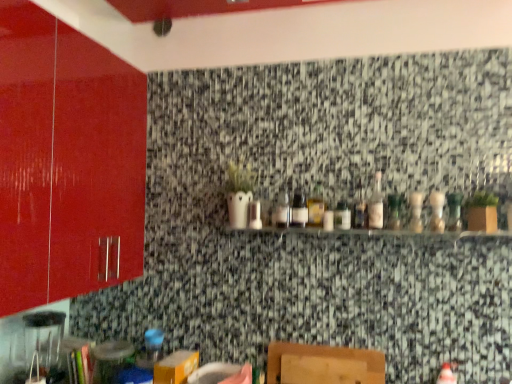
Question: Which direction should I rotate to look at green glass bottle at center, arranged as the 4th bottle when viewed from the right?

Choices:
 (A) left
 (B) right

Answer: (B)

Question: Is translucent glass bottle at center, which is counted as the 3th bottle, starting from the right, facing towards clear glass shelf at center?

Choices:
 (A) yes
 (B) no

Answer: (B)

Question: Considering the relative positions of translucent glass bottle at center, which is counted as the 3th bottle, starting from the right, and clear glass shelf at center in the image provided, is translucent glass bottle at center, which is counted as the 3th bottle, starting from the right, to the left of clear glass shelf at center from the viewer's perspective?

Choices:
 (A) yes
 (B) no

Answer: (B)

Question: Is translucent glass bottle at center, acting as the 7th bottle starting from the left, placed right next to clear glass shelf at center?

Choices:
 (A) yes
 (B) no

Answer: (B)

Question: Considering the relative positions of translucent glass bottle at center, acting as the 7th bottle starting from the left, and clear glass shelf at center in the image provided, is translucent glass bottle at center, acting as the 7th bottle starting from the left, to the right of clear glass shelf at center from the viewer's perspective?

Choices:
 (A) no
 (B) yes

Answer: (B)

Question: From the image's perspective, is translucent glass bottle at center, acting as the 7th bottle starting from the left, located above clear glass shelf at center?

Choices:
 (A) no
 (B) yes

Answer: (B)

Question: From the image's perspective, would you say translucent glass bottle at center, acting as the 7th bottle starting from the left, is shown under clear glass shelf at center?

Choices:
 (A) no
 (B) yes

Answer: (A)

Question: Does clear glass bottle at center, the fourth bottle when ordered from left to right, appear on the right side of translucent glass bottle at center, which is the ninth bottle in right-to-left order?

Choices:
 (A) no
 (B) yes

Answer: (B)

Question: Is translucent glass bottle at center, which is the ninth bottle in right-to-left order, located within clear glass bottle at center, the 6th bottle in the right-to-left sequence?

Choices:
 (A) no
 (B) yes

Answer: (A)

Question: Is clear glass bottle at center, the 6th bottle in the right-to-left sequence, bigger than translucent glass bottle at center, marked as the 1th bottle in a left-to-right arrangement?

Choices:
 (A) yes
 (B) no

Answer: (A)

Question: Is clear glass bottle at center, the 6th bottle in the right-to-left sequence, thinner than translucent glass bottle at center, marked as the 1th bottle in a left-to-right arrangement?

Choices:
 (A) no
 (B) yes

Answer: (B)

Question: Considering the relative positions of clear glass bottle at center, the fourth bottle when ordered from left to right, and translucent glass bottle at center, marked as the 1th bottle in a left-to-right arrangement, in the image provided, is clear glass bottle at center, the fourth bottle when ordered from left to right, to the left of translucent glass bottle at center, marked as the 1th bottle in a left-to-right arrangement, from the viewer's perspective?

Choices:
 (A) yes
 (B) no

Answer: (B)

Question: From the image's perspective, would you say clear glass bottle at center, the 6th bottle in the right-to-left sequence, is positioned over translucent glass bottle at center, marked as the 1th bottle in a left-to-right arrangement?

Choices:
 (A) no
 (B) yes

Answer: (B)

Question: Considering the relative sizes of clear glass shelf at center and translucent glass bottle at center, marked as the 1th bottle in a left-to-right arrangement, in the image provided, is clear glass shelf at center thinner than translucent glass bottle at center, marked as the 1th bottle in a left-to-right arrangement,?

Choices:
 (A) yes
 (B) no

Answer: (B)